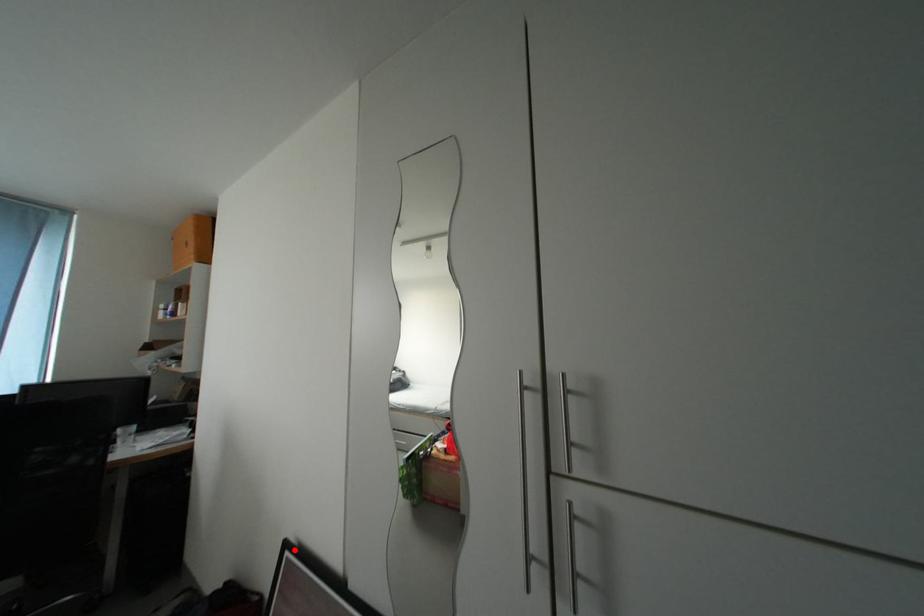
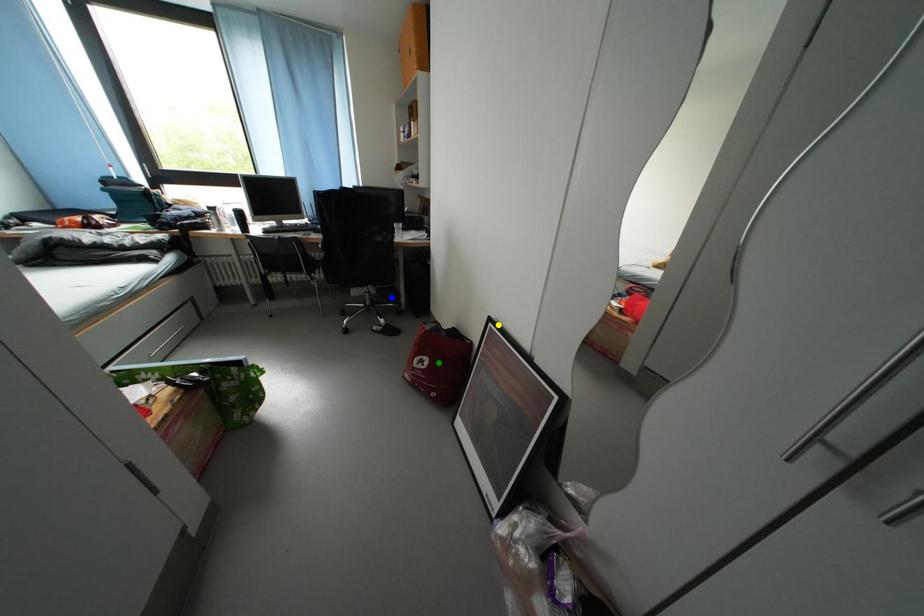
Question: I am providing you with two images of the same scene from different viewpoints. A red point is marked on the first image. You are given multiple points on the second image. Which mark in image 2 goes with the point in image 1?

Choices:
 (A) blue point
 (B) green point
 (C) yellow point

Answer: (C)